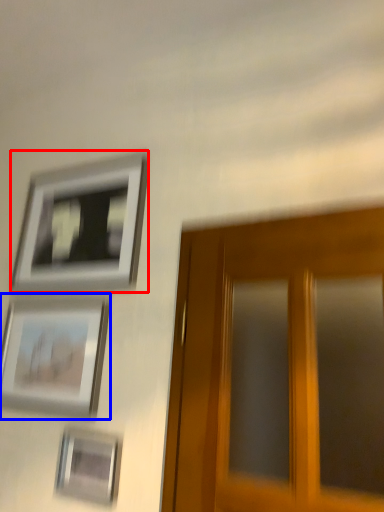
Question: Which of the following is the farthest to the observer, picture frame (highlighted by a red box) or picture frame (highlighted by a blue box)?

Choices:
 (A) picture frame
 (B) picture frame

Answer: (A)